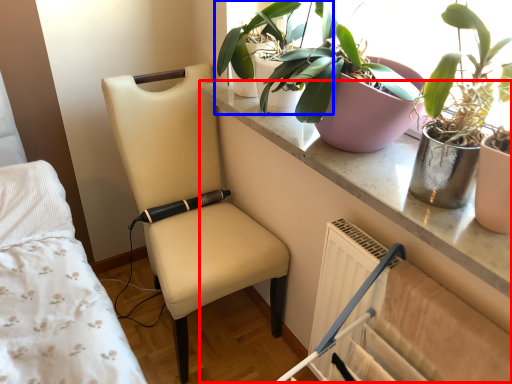
Question: Which object appears farthest to the camera in this image, table (highlighted by a red box) or houseplant (highlighted by a blue box)?

Choices:
 (A) table
 (B) houseplant

Answer: (B)